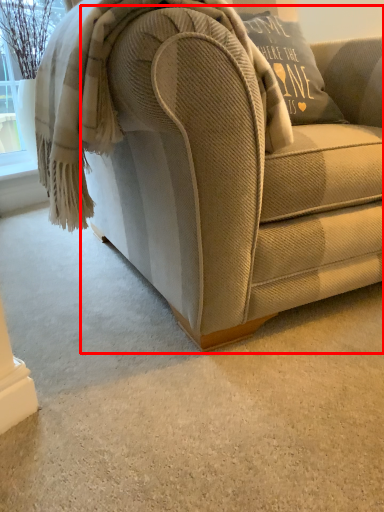
Question: Observing the image, what is the correct spatial positioning of studio couch (annotated by the red box) in reference to blanket?

Choices:
 (A) left
 (B) right

Answer: (B)